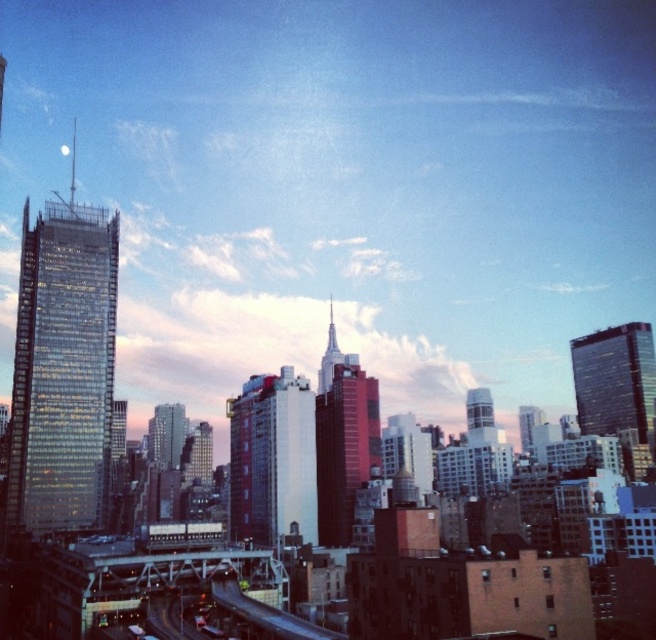
Question: Can you confirm if red glass skyscraper at center is positioned above glassy reflective skyscraper at upper center?

Choices:
 (A) yes
 (B) no

Answer: (B)

Question: Is glassy reflective skyscraper at left to the right of shiny glass spire at center from the viewer's perspective?

Choices:
 (A) yes
 (B) no

Answer: (B)

Question: Which object is closer to the camera taking this photo?

Choices:
 (A) red brick building at center
 (B) glassy reflective skyscraper at upper center

Answer: (A)

Question: In this image, where is red brick building at center located relative to metallic glass skyscraper at center?

Choices:
 (A) above
 (B) below

Answer: (A)

Question: Estimate the real-world distances between objects in this image. Which object is farther from the matte glass building at center?

Choices:
 (A) red brick building at center
 (B) shiny glass spire at center

Answer: (A)

Question: Estimate the real-world distances between objects in this image. Which object is closer to the shiny glass spire at center?

Choices:
 (A) matte glass building at center
 (B) metallic glass skyscraper at center
 (C) red glass skyscraper at center

Answer: (C)